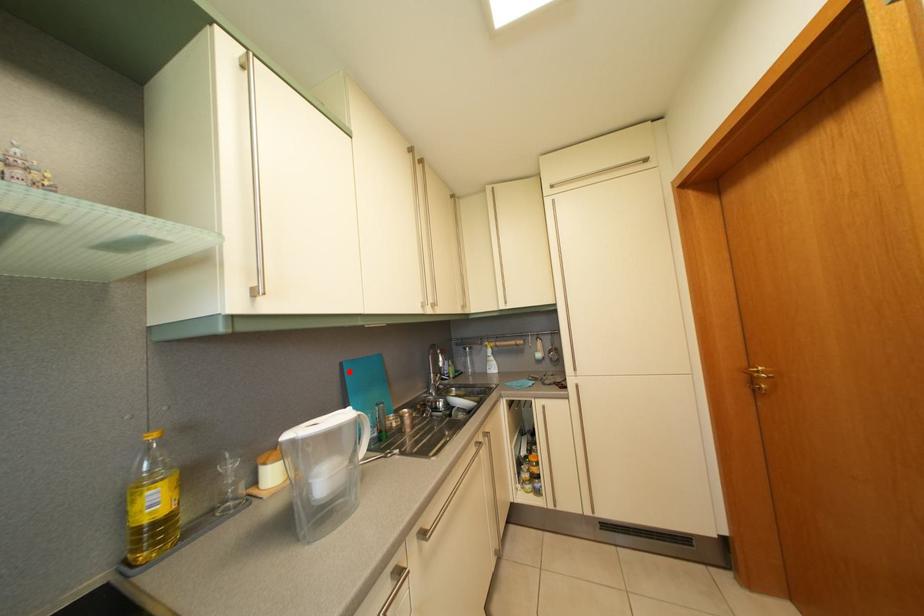
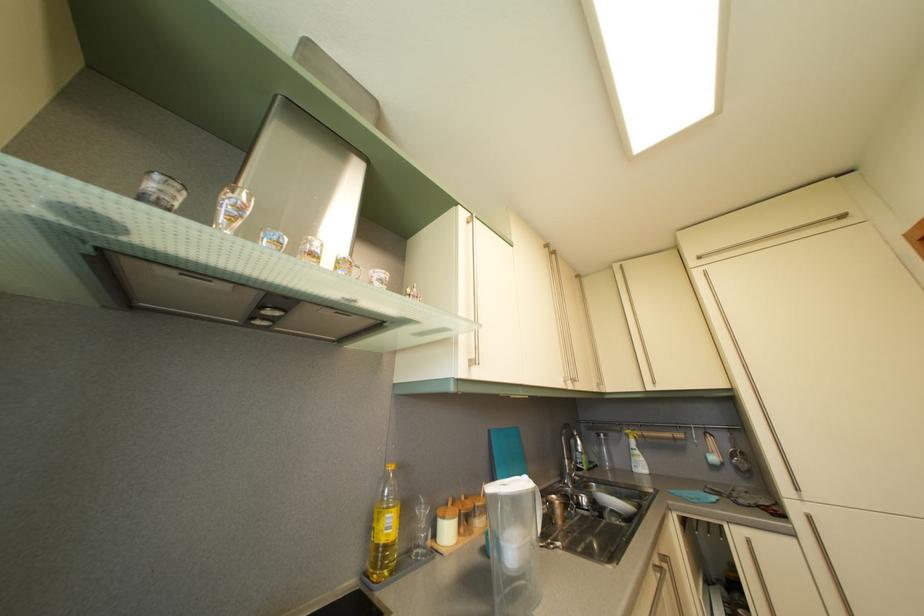
Question: I am providing you with two images of the same scene from different viewpoints. Given a red point in image1, look at the same physical point in image2. Is it:

Choices:
 (A) Closer to the viewpoint
 (B) Farther from the viewpoint

Answer: (B)